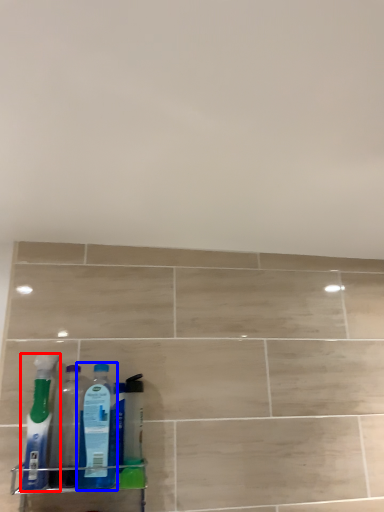
Question: Which point is further to the camera, bottle (highlighted by a red box) or bottle (highlighted by a blue box)?

Choices:
 (A) bottle
 (B) bottle

Answer: (B)